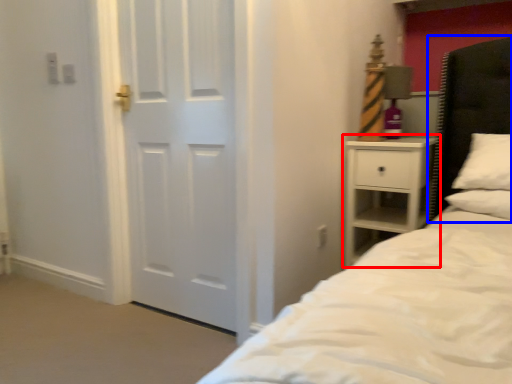
Question: Which object appears farthest to the camera in this image, nightstand (highlighted by a red box) or headboard (highlighted by a blue box)?

Choices:
 (A) nightstand
 (B) headboard

Answer: (A)